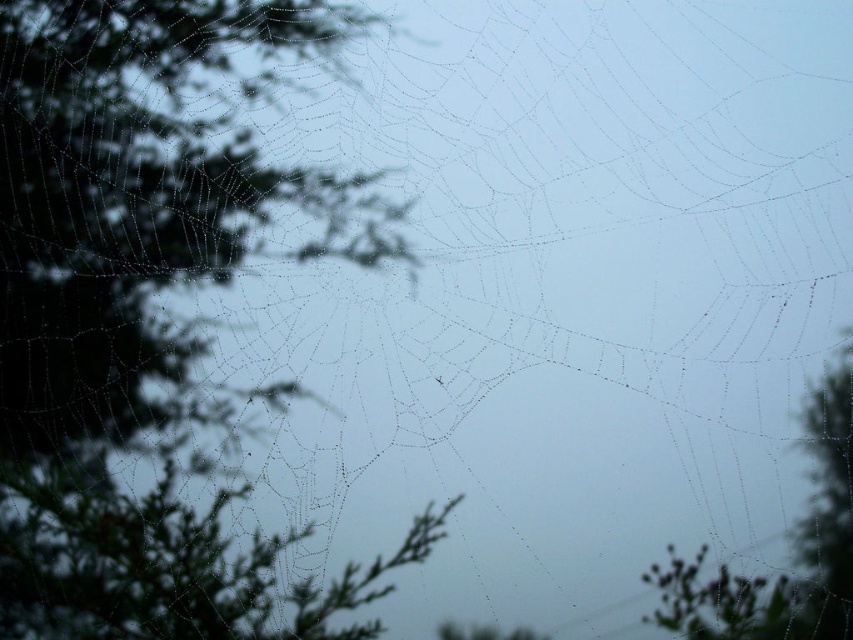
Between point (67, 120) and point (728, 605), which one is positioned behind?

The point (67, 120) is behind.

Can you confirm if green leafy tree at left is positioned above green leafy tree at right?

→ Yes, green leafy tree at left is above green leafy tree at right.

Measure the distance between green leafy tree at left and camera.

They are 3.91 meters apart.

The width and height of the screenshot is (853, 640). Identify the location of green leafy tree at left. (142, 312).